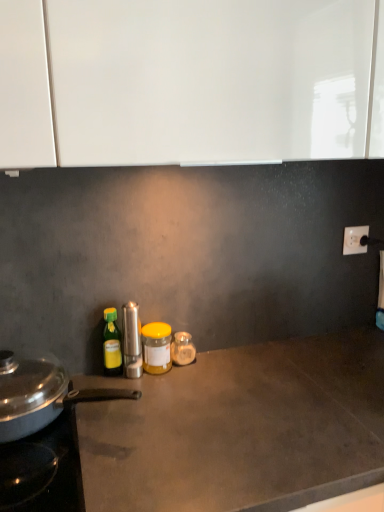
Question: From a real-world perspective, relative to metallic silver pan at left, which appears as the first kitchen appliance when viewed from the left, is green plastic bottle at left, the 3th bottle positioned from the right, vertically above or below?

Choices:
 (A) below
 (B) above

Answer: (B)

Question: From the image's perspective, is green plastic bottle at left, the 1th bottle viewed from the left, above or below metallic silver pan at left, the 2th kitchen appliance viewed from the right?

Choices:
 (A) above
 (B) below

Answer: (A)

Question: Estimate the real-world distances between objects in this image. Which object is farther from the satin silver pepper mill at center, the 1th kitchen appliance positioned from the right?

Choices:
 (A) green plastic bottle at left, the 3th bottle positioned from the right
 (B) white plastic electric outlet at upper right
 (C) translucent glass jar at center, arranged as the third bottle when viewed from the left
 (D) metallic silver pan at left, which appears as the first kitchen appliance when viewed from the left
 (E) yellow matte jar at center, which ranks as the second bottle in left-to-right order

Answer: (B)

Question: Which of these objects is positioned farthest from the white plastic electric outlet at upper right?

Choices:
 (A) translucent glass jar at center, arranged as the third bottle when viewed from the left
 (B) yellow matte jar at center, which is the 2th bottle from right to left
 (C) satin silver pepper mill at center, the 1th kitchen appliance positioned from the right
 (D) green plastic bottle at left, the 3th bottle positioned from the right
 (E) metallic silver pan at left, the 2th kitchen appliance viewed from the right

Answer: (E)